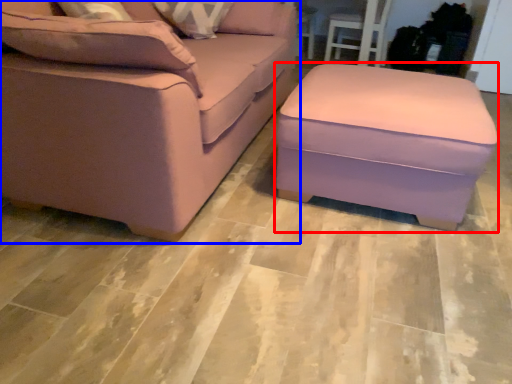
Question: Among these objects, which one is farthest to the camera, stool (highlighted by a red box) or studio couch (highlighted by a blue box)?

Choices:
 (A) stool
 (B) studio couch

Answer: (A)